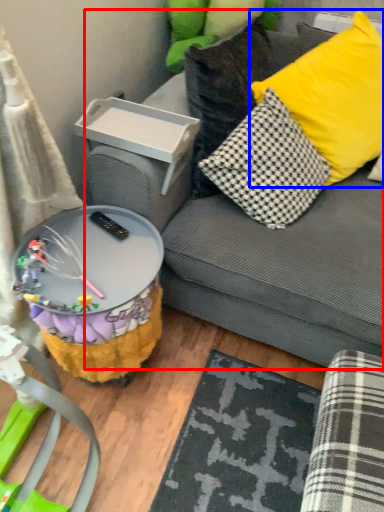
Question: Among these objects, which one is farthest to the camera, studio couch (highlighted by a red box) or pillow (highlighted by a blue box)?

Choices:
 (A) studio couch
 (B) pillow

Answer: (B)